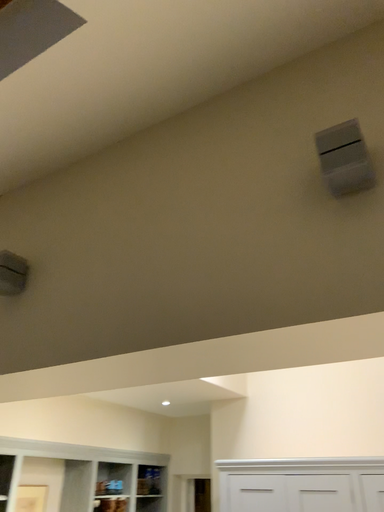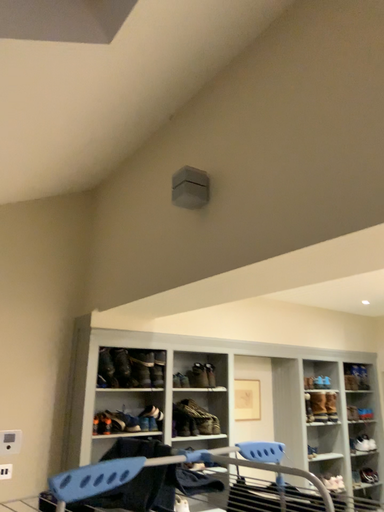
Question: Which way did the camera rotate in the video?

Choices:
 (A) rotated downward
 (B) rotated upward

Answer: (A)